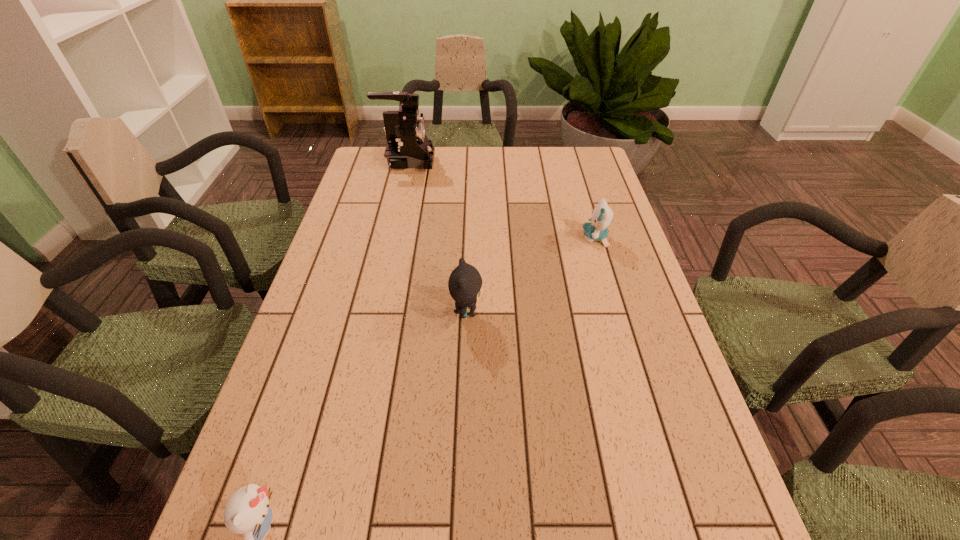
In order to click on free point between the camcorder and the second nearest kitten in this screenshot , I will do `click(437, 237)`.

Locate an element on the screen. The width and height of the screenshot is (960, 540). vacant space that's between the second farthest object and the second nearest object is located at coordinates (531, 275).

The width and height of the screenshot is (960, 540). What are the coordinates of `vacant space that's between the third farthest object and the tallest object` in the screenshot? It's located at (437, 237).

Find the location of `vacant space that is in between the farthest kitten and the tallest kitten`. vacant space that is in between the farthest kitten and the tallest kitten is located at coordinates (531, 275).

Where is `empty space that is in between the camcorder and the third nearest object`? empty space that is in between the camcorder and the third nearest object is located at coordinates (501, 199).

You are a GUI agent. You are given a task and a screenshot of the screen. Output one action in this format:
    pyautogui.click(x=<x>, y=<y>)
    Task: Click on the free spot between the second farthest object and the farthest object
    This screenshot has height=540, width=960.
    Given the screenshot: What is the action you would take?
    pyautogui.click(x=501, y=199)

Find the location of a particular element. unoccupied position between the third nearest object and the second kitten from left to right is located at coordinates (531, 275).

Identify the location of the closest object to the tallest object. (596, 230).

Find the location of a particular element. This screenshot has height=540, width=960. object that is the closest to the tallest object is located at coordinates click(x=596, y=230).

Where is `kitten object that ranks as the second closest to the farthest object`? Image resolution: width=960 pixels, height=540 pixels. kitten object that ranks as the second closest to the farthest object is located at coordinates (465, 282).